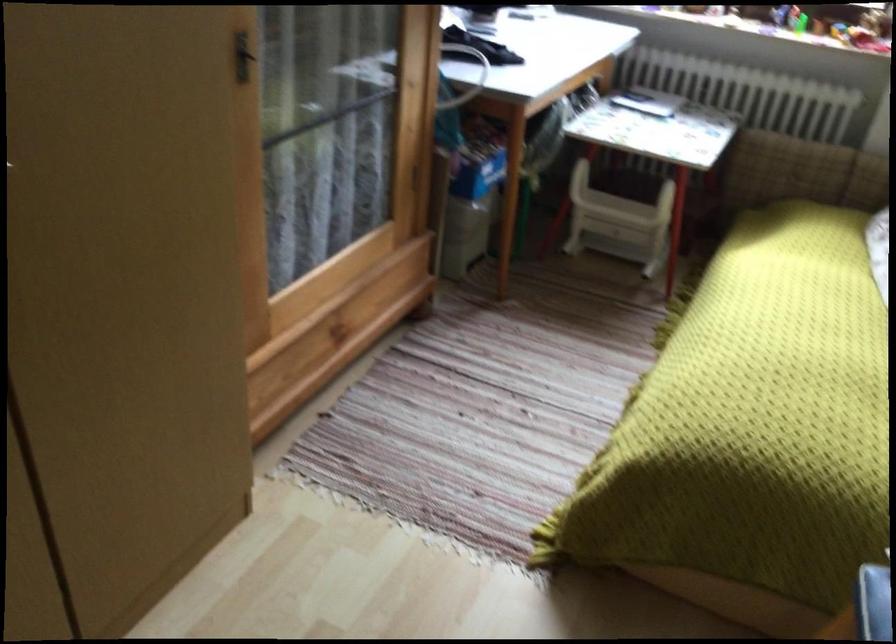
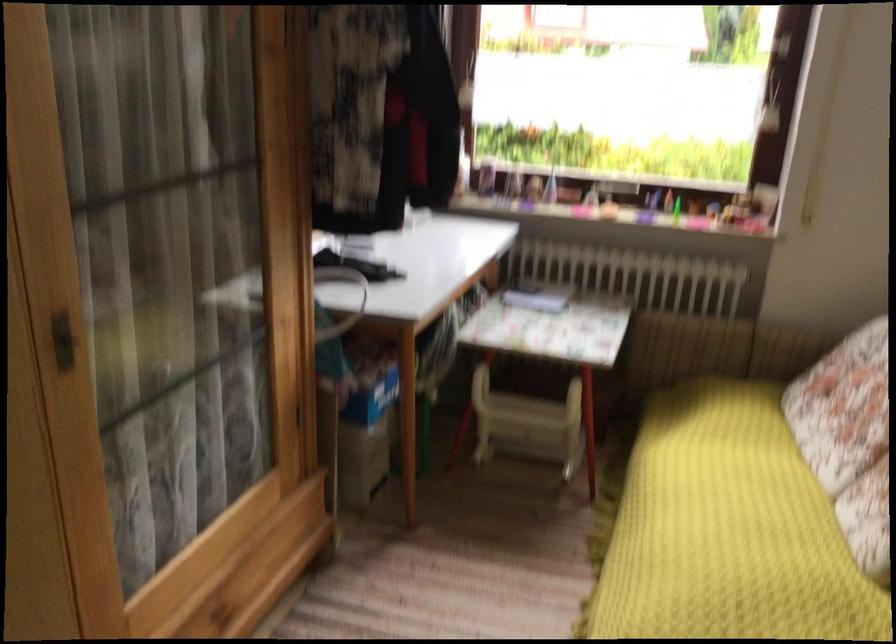
Where in the second image is the point corresponding to point 780,312 from the first image?

(728, 529)